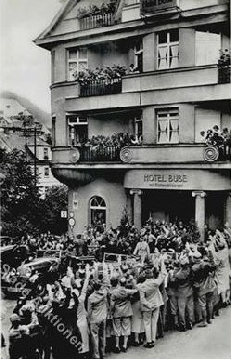
This screenshot has width=231, height=359. I want to click on hotel, so click(x=200, y=84).